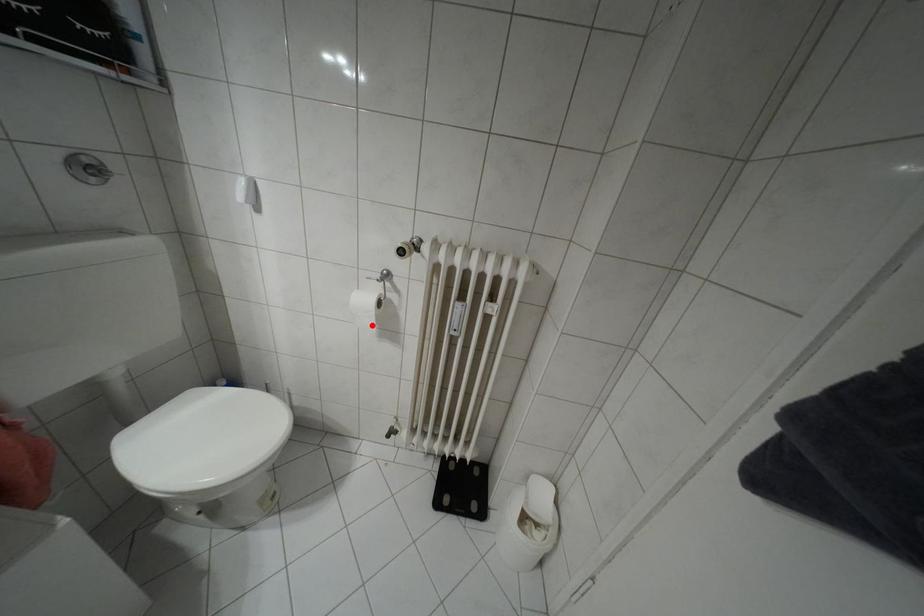
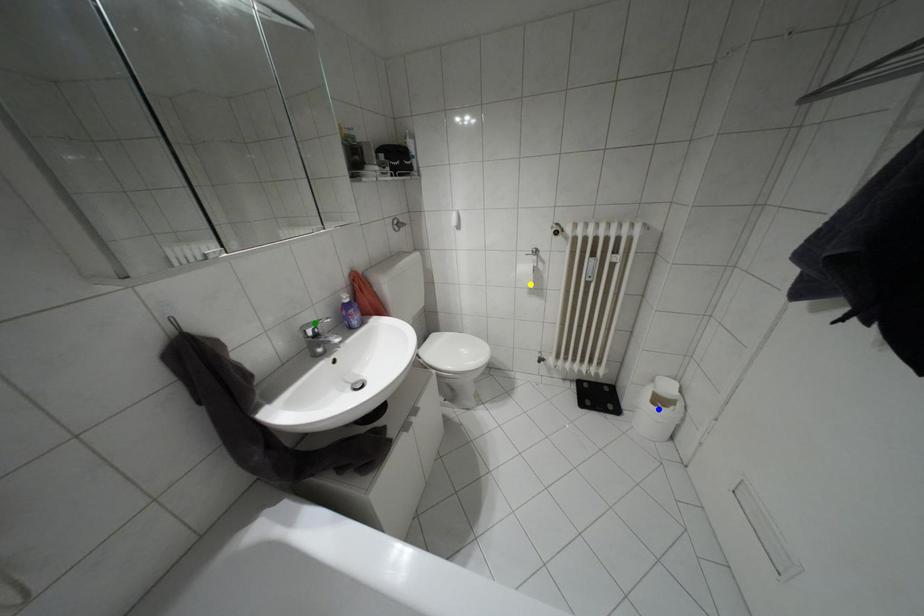
Question: I am providing you with two images of the same scene from different viewpoints. A red point is marked on the first image. You are given multiple points on the second image. Which spot in image 2 lines up with the point in image 1?

Choices:
 (A) yellow point
 (B) blue point
 (C) green point

Answer: (A)